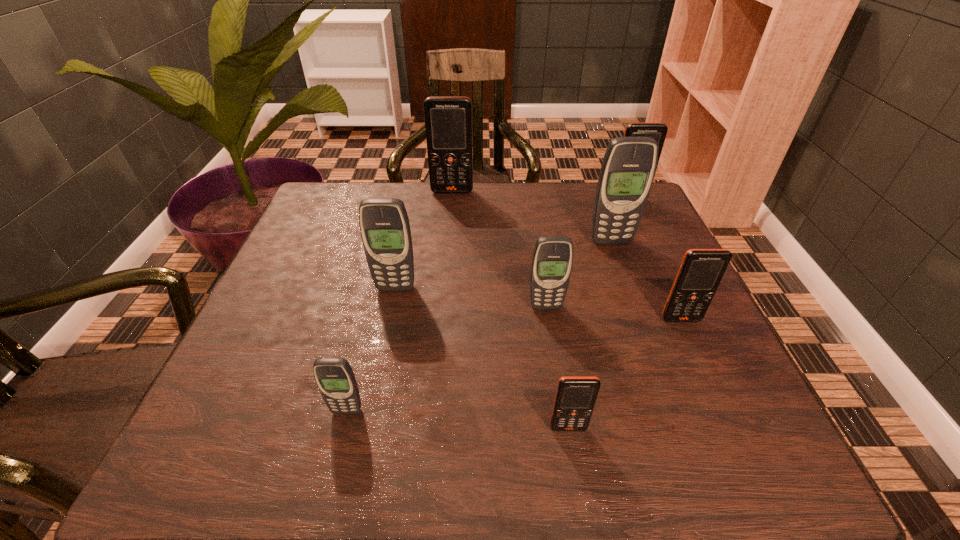
In order to click on free space between the fifth nearest cellular telephone and the third biggest gray cellular telephone in this screenshot , I will do `click(470, 298)`.

This screenshot has width=960, height=540. In order to click on free spot between the third nearest object and the second nearest object in this screenshot , I will do `click(514, 365)`.

In order to click on empty space between the nearest cellular telephone and the second farthest object in this screenshot , I will do `click(598, 315)`.

Where is `free spot between the third farthest object and the second smallest gray cellular telephone`? free spot between the third farthest object and the second smallest gray cellular telephone is located at coordinates (578, 274).

Identify the location of vacant region between the second gray cellular telephone from right to left and the seventh nearest object. The width and height of the screenshot is (960, 540). (588, 254).

Where is `free space that is in between the third smallest gray cellular telephone and the rightmost gray cellular telephone`? free space that is in between the third smallest gray cellular telephone and the rightmost gray cellular telephone is located at coordinates (503, 265).

Find the location of a particular element. unoccupied area between the nearest gray cellular telephone and the second farthest cellular telephone is located at coordinates (488, 306).

Identify which object is the fourth closest to the second farthest gray cellular telephone. Please provide its 2D coordinates. Your answer should be formatted as a tuple, i.e. [(x, y)], where the tuple contains the x and y coordinates of a point satisfying the conditions above.

[(575, 398)]

In order to click on object that ranks as the seventh closest to the second nearest cellular telephone in this screenshot , I will do `click(657, 131)`.

Where is `cellular telephone that is the second nearest to the second biggest gray cellular telephone`? The height and width of the screenshot is (540, 960). cellular telephone that is the second nearest to the second biggest gray cellular telephone is located at coordinates (335, 378).